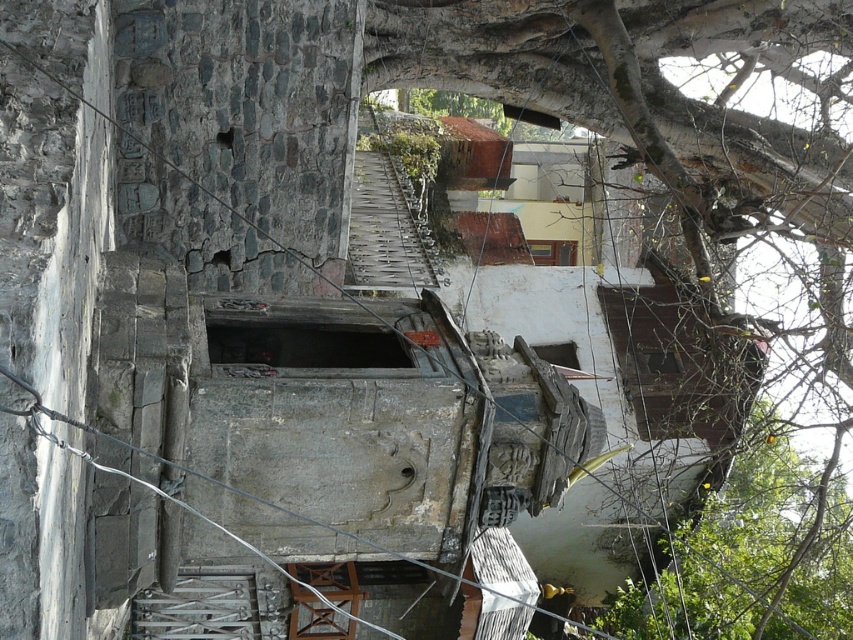
Question: Which is farther from the metallic wrought iron stairs at lower center?

Choices:
 (A) green leafy tree at upper right
 (B) wooden stool at center

Answer: (A)

Question: Can you confirm if green leafy tree at upper right is positioned above wooden stool at center?

Choices:
 (A) no
 (B) yes

Answer: (B)

Question: Which of these objects is positioned closest to the wooden stool at center?

Choices:
 (A) green leafy tree at upper right
 (B) metallic wrought iron stairs at lower center

Answer: (B)

Question: Can you confirm if metallic wrought iron stairs at lower center is positioned to the right of wooden stool at center?

Choices:
 (A) no
 (B) yes

Answer: (A)

Question: Which point appears farthest from the camera in this image?

Choices:
 (A) (843, 426)
 (B) (209, 628)
 (C) (299, 621)

Answer: (A)

Question: Does metallic wrought iron stairs at lower center have a greater width compared to wooden stool at center?

Choices:
 (A) no
 (B) yes

Answer: (B)